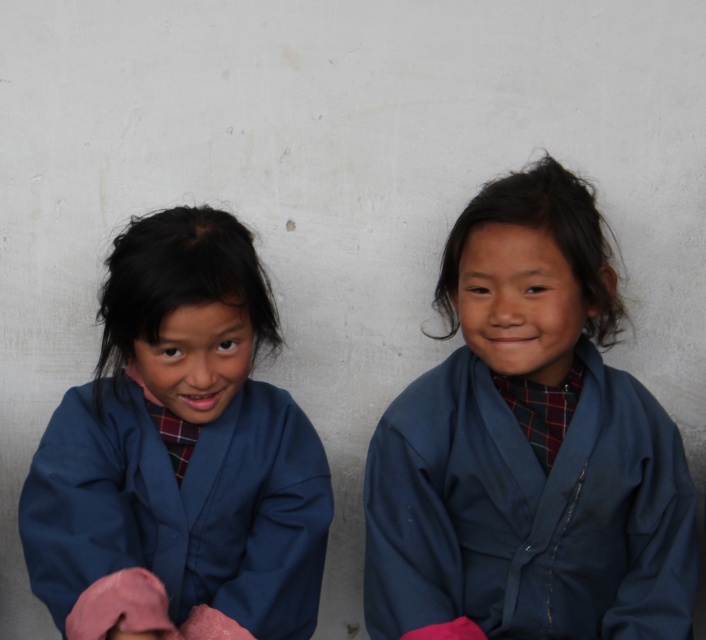
Question: Is blue fabric at left behind blue cotton jacket at right?

Choices:
 (A) no
 (B) yes

Answer: (A)

Question: Which point is farther from the camera taking this photo?

Choices:
 (A) (157, 301)
 (B) (376, 580)

Answer: (B)

Question: Is blue fabric at left smaller than blue cotton jacket at right?

Choices:
 (A) no
 (B) yes

Answer: (A)

Question: Which point is closer to the camera taking this photo?

Choices:
 (A) (174, 484)
 (B) (503, 522)

Answer: (A)

Question: Can you confirm if blue fabric at left is positioned below blue cotton jacket at right?

Choices:
 (A) no
 (B) yes

Answer: (A)